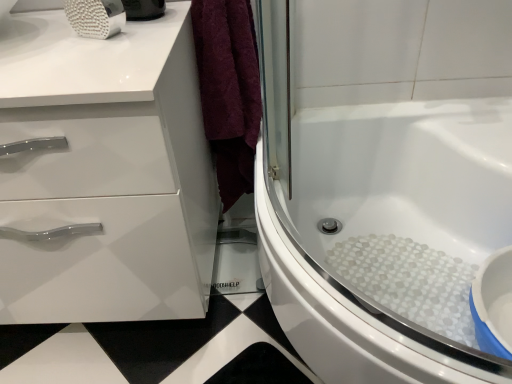
What are the coordinates of `white textured bath at center` in the screenshot? It's located at (390, 238).

The height and width of the screenshot is (384, 512). What do you see at coordinates (390, 238) in the screenshot?
I see `white textured bath at center` at bounding box center [390, 238].

You are a GUI agent. You are given a task and a screenshot of the screen. Output one action in this format:
    pyautogui.click(x=<x>, y=<y>)
    Task: Click on the white glossy cabinet at left
    The height and width of the screenshot is (384, 512).
    Given the screenshot: What is the action you would take?
    pyautogui.click(x=105, y=172)

What do you see at coordinates (105, 172) in the screenshot?
I see `white glossy cabinet at left` at bounding box center [105, 172].

What is the approximate height of white glossy cabinet at left?

white glossy cabinet at left is 26.70 inches tall.

You are a GUI agent. You are given a task and a screenshot of the screen. Output one action in this format:
    pyautogui.click(x=<x>, y=<y>)
    Task: Click on the white textured bath at center
    
    Given the screenshot: What is the action you would take?
    pyautogui.click(x=390, y=238)

Considering the positions of objects white glossy cabinet at left and white textured bath at center in the image provided, who is more to the left, white glossy cabinet at left or white textured bath at center?

Positioned to the left is white glossy cabinet at left.

Between white glossy cabinet at left and white textured bath at center, which one is positioned behind?

white glossy cabinet at left is further away from the camera.

Does point (127, 55) come behind point (410, 146)?

No, (127, 55) is in front of (410, 146).

From the image's perspective, does white glossy cabinet at left appear higher than white textured bath at center?

Yes, from the image's perspective, white glossy cabinet at left is on top of white textured bath at center.

From a real-world perspective, is white glossy cabinet at left below white textured bath at center?

Incorrect, from a real-world perspective, white glossy cabinet at left is higher than white textured bath at center.

Does white glossy cabinet at left have a greater width compared to white textured bath at center?

No, white glossy cabinet at left is not wider than white textured bath at center.

Considering the relative sizes of white glossy cabinet at left and white textured bath at center in the image provided, is white glossy cabinet at left shorter than white textured bath at center?

No, white glossy cabinet at left is not shorter than white textured bath at center.

Between white glossy cabinet at left and white textured bath at center, which one has larger size?

white textured bath at center.

Is white glossy cabinet at left not inside white textured bath at center?

Yes, white glossy cabinet at left is not within white textured bath at center.

Are white glossy cabinet at left and white textured bath at center far apart?

white glossy cabinet at left is actually quite close to white textured bath at center.

Is white glossy cabinet at left aimed at white textured bath at center?

No, white glossy cabinet at left is not facing towards white textured bath at center.

Looking at this image, how many degrees apart are the facing directions of white glossy cabinet at left and white textured bath at center?

90.7 degrees.

I want to click on bath that is below the white glossy cabinet at left (from the image's perspective), so click(x=390, y=238).

Does white textured bath at center appear on the right side of white glossy cabinet at left?

Yes, white textured bath at center is to the right of white glossy cabinet at left.

Between white textured bath at center and white glossy cabinet at left, which one is positioned behind?

white glossy cabinet at left is more distant.

Considering the points (314, 120) and (94, 72), which point is in front, point (314, 120) or point (94, 72)?

Point (94, 72)

From the image's perspective, which one is positioned lower, white textured bath at center or white glossy cabinet at left?

From the image's view, white textured bath at center is below.

From a real-world perspective, is white textured bath at center physically below white glossy cabinet at left?

Yes, from a real-world perspective, white textured bath at center is below white glossy cabinet at left.

Is white textured bath at center wider than white glossy cabinet at left?

Correct, the width of white textured bath at center exceeds that of white glossy cabinet at left.

Considering the relative sizes of white textured bath at center and white glossy cabinet at left in the image provided, is white textured bath at center shorter than white glossy cabinet at left?

Yes, white textured bath at center is shorter than white glossy cabinet at left.

Is white textured bath at center bigger or smaller than white glossy cabinet at left?

In the image, white textured bath at center appears to be larger than white glossy cabinet at left.

Is white textured bath at center inside or outside of white glossy cabinet at left?

white textured bath at center is spatially situated outside white glossy cabinet at left.

Are white textured bath at center and white glossy cabinet at left far apart?

No, white textured bath at center is not far from white glossy cabinet at left.

Could you tell me if white textured bath at center is facing white glossy cabinet at left?

Yes, white textured bath at center is aimed at white glossy cabinet at left.

What's the angular difference between white textured bath at center and white glossy cabinet at left's facing directions?

white textured bath at center and white glossy cabinet at left are facing 90.7 degrees away from each other.

Measure the distance between white textured bath at center and white glossy cabinet at left.

They are 43.80 centimeters apart.

Locate an element on the screen. bathroom cabinet above the white textured bath at center (from the image's perspective) is located at coordinates (105, 172).

You are a GUI agent. You are given a task and a screenshot of the screen. Output one action in this format:
    pyautogui.click(x=<x>, y=<y>)
    Task: Click on the bathroom cabinet lying above the white textured bath at center (from the image's perspective)
    
    Given the screenshot: What is the action you would take?
    pyautogui.click(x=105, y=172)

Locate an element on the screen. The image size is (512, 384). bathroom cabinet on the left of the white textured bath at center is located at coordinates (105, 172).